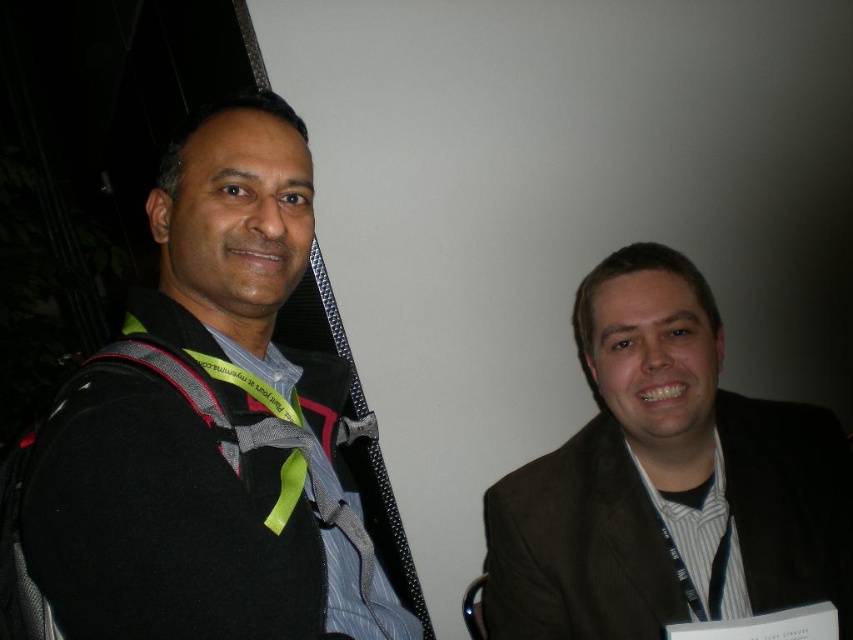
Which is more to the left, black fabric backpack at left or brown textured suit at right?

black fabric backpack at left is more to the left.

At what (x,y) coordinates should I click in order to perform the action: click on black fabric backpack at left. Please return your answer as a coordinate pair (x, y). The width and height of the screenshot is (853, 640). Looking at the image, I should click on (201, 433).